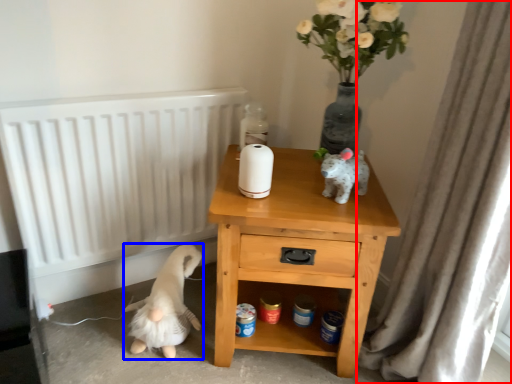
Question: Which point is closer to the camera, curtain (highlighted by a red box) or animal (highlighted by a blue box)?

Choices:
 (A) curtain
 (B) animal

Answer: (A)